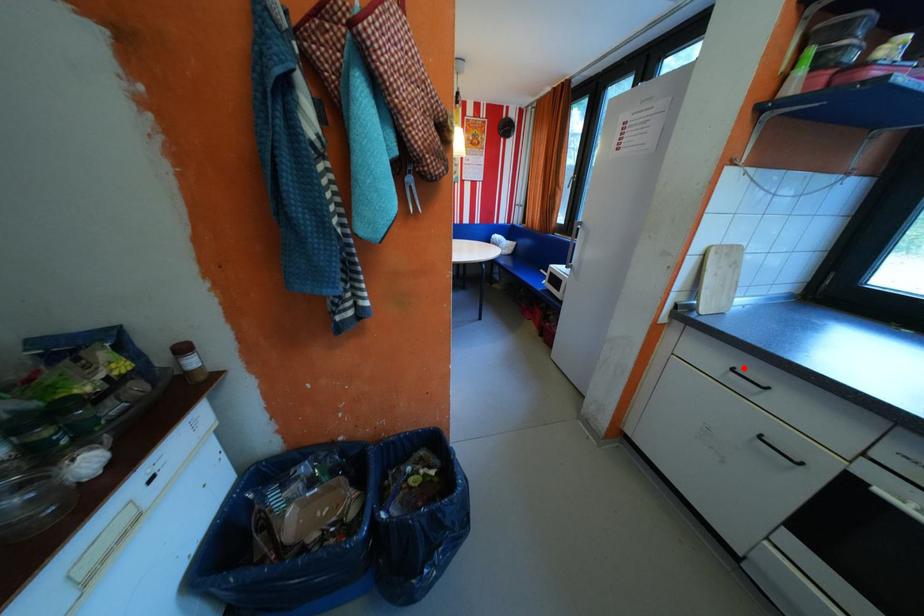
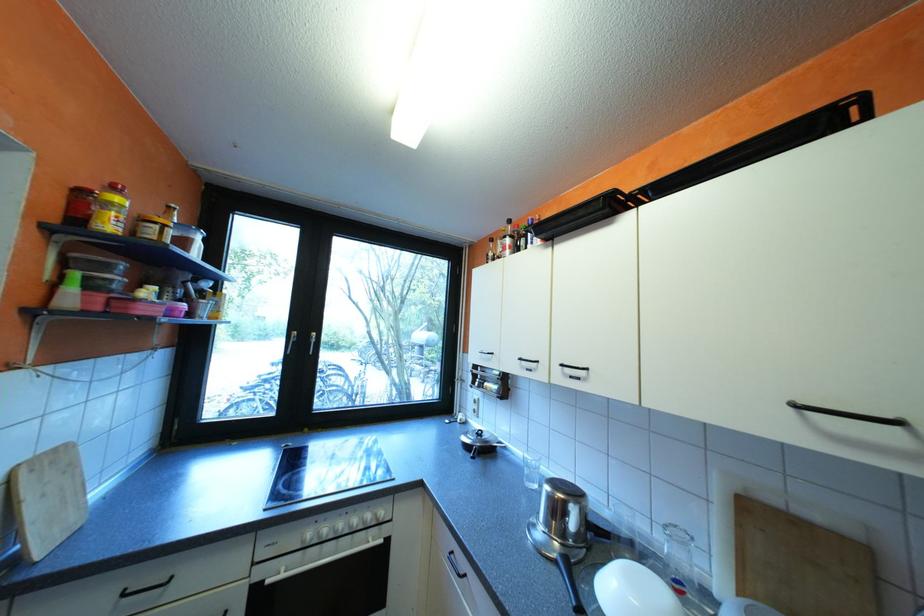
Question: I am providing you with two images of the same scene from different viewpoints. A red point is shown in image1. For the corresponding object point in image2, is it positioned nearer or farther from the camera?

Choices:
 (A) Nearer
 (B) Farther

Answer: (A)